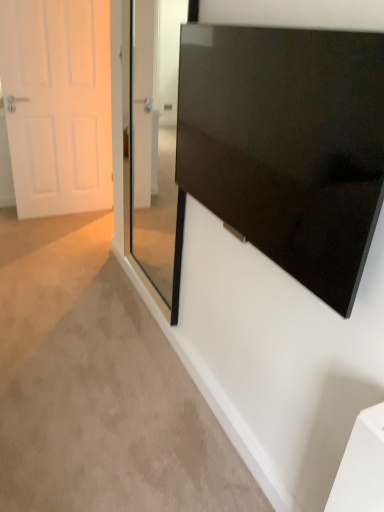
Question: From a real-world perspective, relative to glossy black screen at upper right, is transparent glass door at center vertically above or below?

Choices:
 (A) above
 (B) below

Answer: (B)

Question: From the image's perspective, is transparent glass door at center above or below glossy black screen at upper right?

Choices:
 (A) above
 (B) below

Answer: (A)

Question: Which object is positioned farthest from the white matte door at left?

Choices:
 (A) transparent glass door at center
 (B) glossy black screen at upper right

Answer: (B)

Question: Based on their relative distances, which object is farther from the glossy black screen at upper right?

Choices:
 (A) white matte door at left
 (B) transparent glass door at center

Answer: (A)